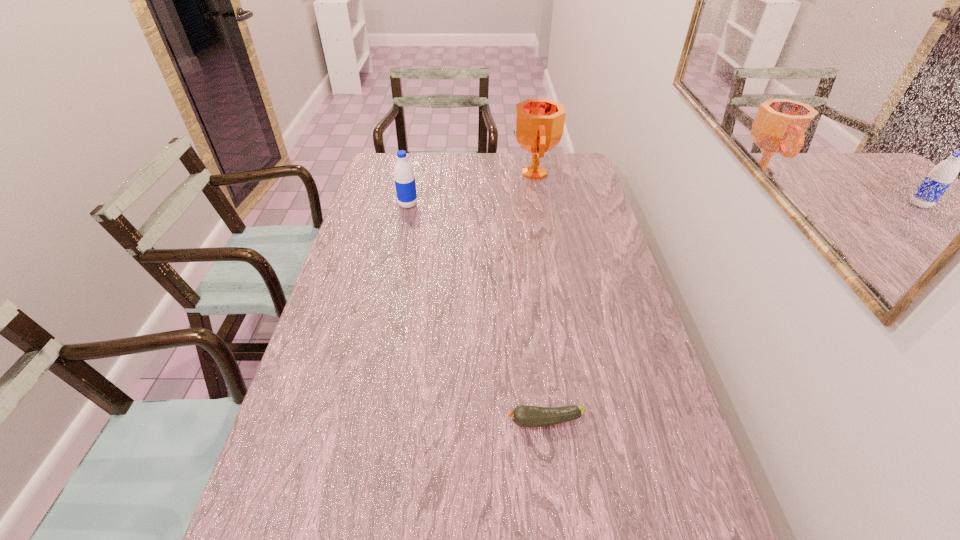
Locate an element on the screen. The image size is (960, 540). free space located at the blossom end of the nearest object is located at coordinates (474, 421).

Locate an element on the screen. The height and width of the screenshot is (540, 960). free space located at the blossom end of the nearest object is located at coordinates coord(422,421).

Where is `vacant space situated 0.270m at the blossom end of the nearest object`? Image resolution: width=960 pixels, height=540 pixels. vacant space situated 0.270m at the blossom end of the nearest object is located at coordinates (388, 421).

Identify the location of object that is at the far edge. (538, 127).

The image size is (960, 540). I want to click on object that is at the left edge, so click(x=405, y=185).

Locate an element on the screen. This screenshot has width=960, height=540. object located at the right edge is located at coordinates (538, 127).

Identify the location of object that is positioned at the far right corner. (538, 127).

In order to click on blank space at the far edge in this screenshot , I will do point(460,172).

Find the location of a particular element. vacant space at the left edge of the desktop is located at coordinates (333, 306).

I want to click on vacant area at the right edge, so click(x=617, y=357).